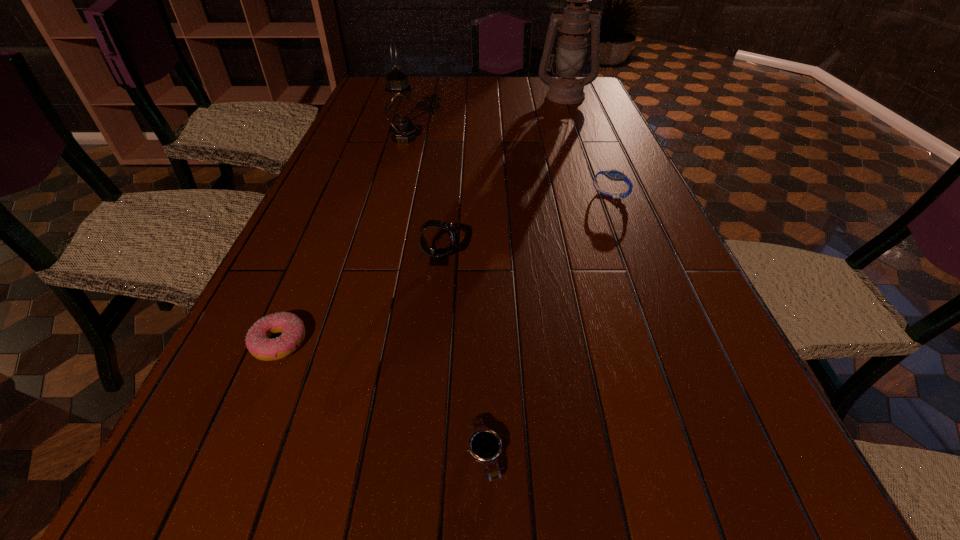
Locate an element on the screen. The height and width of the screenshot is (540, 960). the farther oil lamp is located at coordinates (574, 23).

Find the location of a particular element. This screenshot has width=960, height=540. the right oil lamp is located at coordinates (574, 23).

Find the location of a particular element. The width and height of the screenshot is (960, 540). the fifth nearest object is located at coordinates (400, 112).

At what (x,y) coordinates should I click in order to perform the action: click on the nearer oil lamp. Please return your answer as a coordinate pair (x, y). This screenshot has width=960, height=540. Looking at the image, I should click on (400, 112).

Locate an element on the screen. the tallest watch is located at coordinates (439, 257).

In order to click on the fourth farthest object in this screenshot , I will do `click(439, 257)`.

This screenshot has height=540, width=960. Identify the location of the third farthest object. (616, 175).

I want to click on the farthest watch, so click(616, 175).

You are a GUI agent. You are given a task and a screenshot of the screen. Output one action in this format:
    pyautogui.click(x=<x>, y=<y>)
    Task: Click on the doughnut
    The image size is (960, 540).
    Given the screenshot: What is the action you would take?
    pyautogui.click(x=258, y=342)

The image size is (960, 540). I want to click on the fifth farthest object, so click(x=258, y=342).